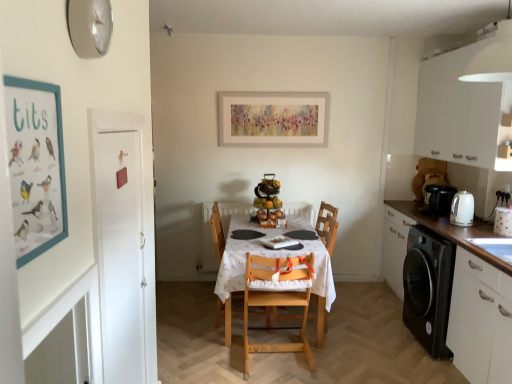
Find the location of a particular element. The height and width of the screenshot is (384, 512). free space between white wood table at center and natural wood highchair at center, arranged as the first chair when viewed from the front is located at coordinates (286, 358).